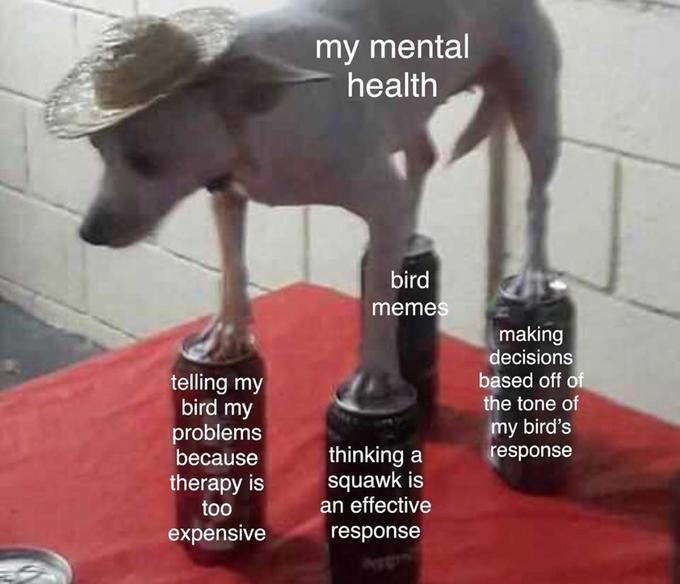
This screenshot has height=584, width=680. In order to click on white brick wall in this screenshot , I will do `click(52, 245)`.